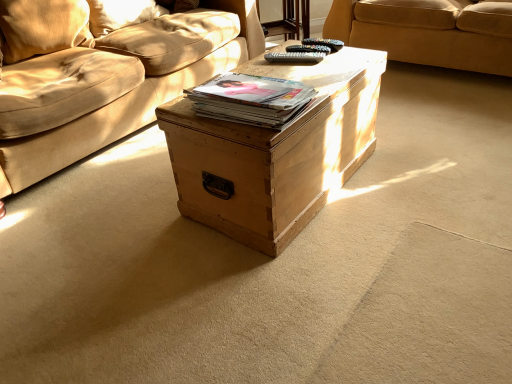
Question: Considering the relative positions of velvet beige pillow at upper left, the second pillow in the back-to-front sequence, and beige fabric couch at upper center in the image provided, is velvet beige pillow at upper left, the second pillow in the back-to-front sequence, to the left of beige fabric couch at upper center from the viewer's perspective?

Choices:
 (A) yes
 (B) no

Answer: (A)

Question: Can you confirm if velvet beige pillow at upper left, the second pillow in the back-to-front sequence, is taller than beige fabric couch at upper center?

Choices:
 (A) yes
 (B) no

Answer: (B)

Question: From a real-world perspective, is velvet beige pillow at upper left, which is the first pillow in front-to-back order, physically above beige fabric couch at upper center?

Choices:
 (A) no
 (B) yes

Answer: (B)

Question: Could you tell me if velvet beige pillow at upper left, which is the first pillow in front-to-back order, is turned towards beige fabric couch at upper center?

Choices:
 (A) no
 (B) yes

Answer: (A)

Question: Can you confirm if velvet beige pillow at upper left, the second pillow in the back-to-front sequence, is shorter than beige fabric couch at upper center?

Choices:
 (A) yes
 (B) no

Answer: (A)

Question: From a real-world perspective, is natural wood trunk at center physically located above or below matte brown book at center?

Choices:
 (A) above
 (B) below

Answer: (B)

Question: Looking at the image, does natural wood trunk at center seem bigger or smaller compared to matte brown book at center?

Choices:
 (A) big
 (B) small

Answer: (A)

Question: Relative to matte brown book at center, is natural wood trunk at center in front or behind?

Choices:
 (A) behind
 (B) front

Answer: (A)

Question: Is point (248, 226) positioned closer to the camera than point (275, 117)?

Choices:
 (A) closer
 (B) farther

Answer: (B)

Question: Is point (206, 92) positioned closer to the camera than point (10, 44)?

Choices:
 (A) farther
 (B) closer

Answer: (B)

Question: In terms of width, does matte brown book at center look wider or thinner when compared to velvet beige pillow at upper left, which is the first pillow in front-to-back order?

Choices:
 (A) wide
 (B) thin

Answer: (A)

Question: In terms of size, does matte brown book at center appear bigger or smaller than velvet beige pillow at upper left, which is the first pillow in front-to-back order?

Choices:
 (A) small
 (B) big

Answer: (A)

Question: In the image, is matte brown book at center on the left side or the right side of velvet beige pillow at upper left, the second pillow in the back-to-front sequence?

Choices:
 (A) left
 (B) right

Answer: (B)

Question: Do you think natural wood trunk at center is within velvet beige pillow at upper left, which is the first pillow in front-to-back order, or outside of it?

Choices:
 (A) outside
 (B) inside

Answer: (A)

Question: Would you say natural wood trunk at center is to the left or to the right of velvet beige pillow at upper left, the second pillow in the back-to-front sequence, in the picture?

Choices:
 (A) left
 (B) right

Answer: (B)